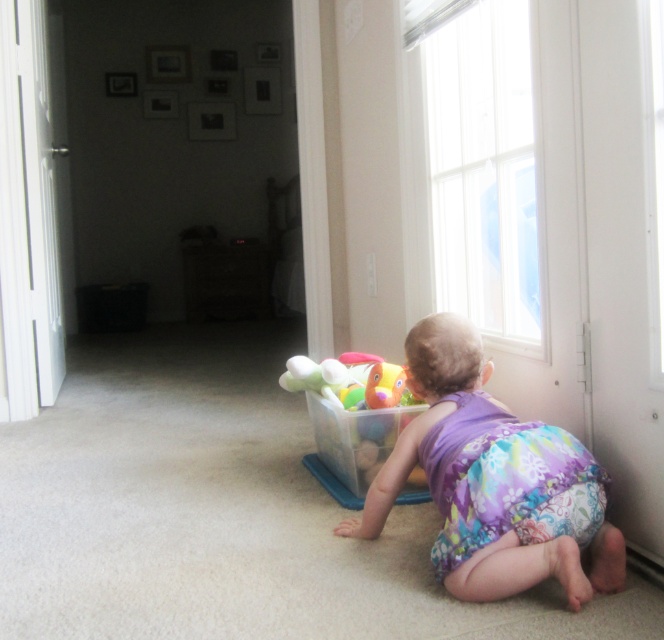
Looking at this image, who is more forward, (x=448, y=518) or (x=363, y=376)?

Point (x=448, y=518) is more forward.

Who is taller, floral fabric diaper at lower center or translucent plastic container at center?

translucent plastic container at center

Is point (481, 461) farther from viewer compared to point (361, 436)?

No, (481, 461) is closer to viewer.

The height and width of the screenshot is (640, 664). I want to click on floral fabric diaper at lower center, so click(517, 492).

Can you confirm if purple floral fabric toddler at lower right is positioned below translucent plastic container at center?

Correct, purple floral fabric toddler at lower right is located below translucent plastic container at center.

Does purple floral fabric toddler at lower right have a greater width compared to translucent plastic container at center?

Indeed, purple floral fabric toddler at lower right has a greater width compared to translucent plastic container at center.

Find the location of a particular element. The image size is (664, 640). purple floral fabric toddler at lower right is located at coordinates (493, 481).

Image resolution: width=664 pixels, height=640 pixels. Identify the location of purple floral fabric toddler at lower right. (493, 481).

Does point (501, 481) lie behind point (517, 516)?

That is True.

Consider the image. Between purple floral fabric toddler at lower right and floral fabric diaper at lower center, which one is positioned higher?

floral fabric diaper at lower center is higher up.

Image resolution: width=664 pixels, height=640 pixels. Describe the element at coordinates (493, 481) in the screenshot. I see `purple floral fabric toddler at lower right` at that location.

At what (x,y) coordinates should I click in order to perform the action: click on purple floral fabric toddler at lower right. Please return your answer as a coordinate pair (x, y). The height and width of the screenshot is (640, 664). Looking at the image, I should click on (493, 481).